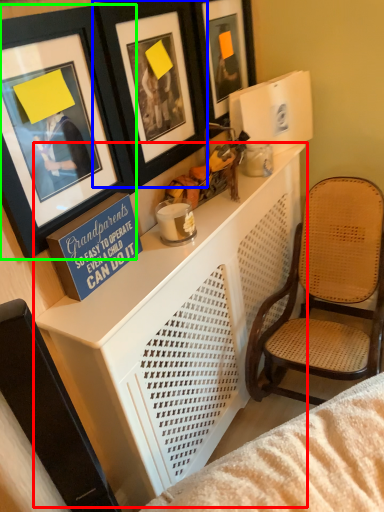
Question: Which object is the closest to the table (highlighted by a red box)? Choose among these: picture frame (highlighted by a blue box) or picture frame (highlighted by a green box).

Choices:
 (A) picture frame
 (B) picture frame

Answer: (B)